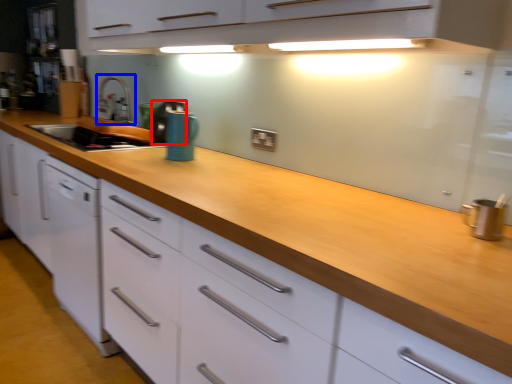
Question: Which point is closer to the camera, appliance (highlighted by a red box) or faucet (highlighted by a blue box)?

Choices:
 (A) appliance
 (B) faucet

Answer: (A)